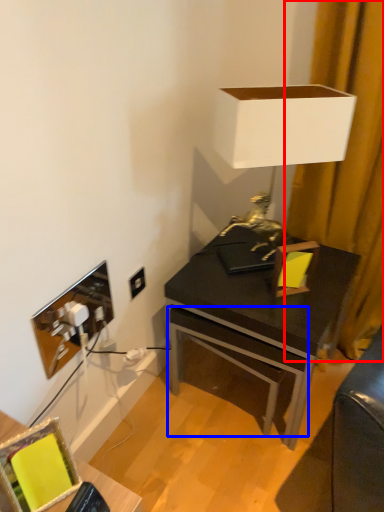
Question: Which object is further to the camera taking this photo, curtain (highlighted by a red box) or drawer (highlighted by a blue box)?

Choices:
 (A) curtain
 (B) drawer

Answer: (B)